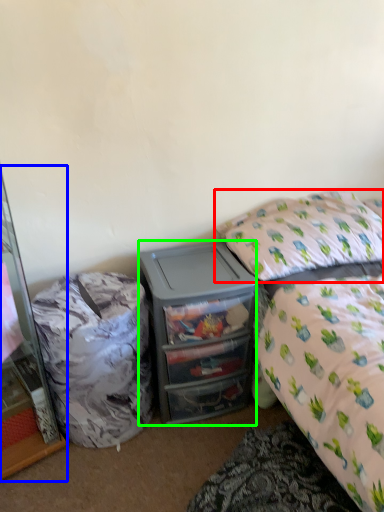
Question: Considering the real-world distances, which object is closest to pillow (highlighted by a red box)? cabinetry (highlighted by a blue box) or desk (highlighted by a green box).

Choices:
 (A) cabinetry
 (B) desk

Answer: (B)